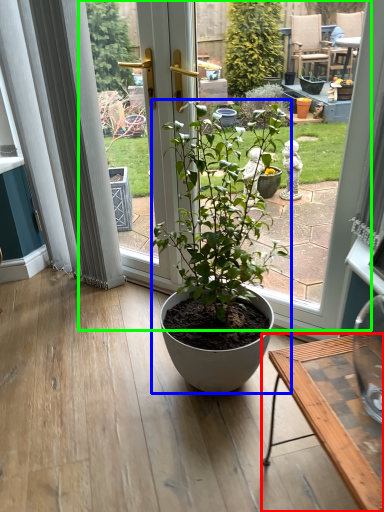
Question: Which is farther away from desk (highlighted by a red box)? houseplant (highlighted by a blue box) or bay window (highlighted by a green box)?

Choices:
 (A) houseplant
 (B) bay window

Answer: (A)